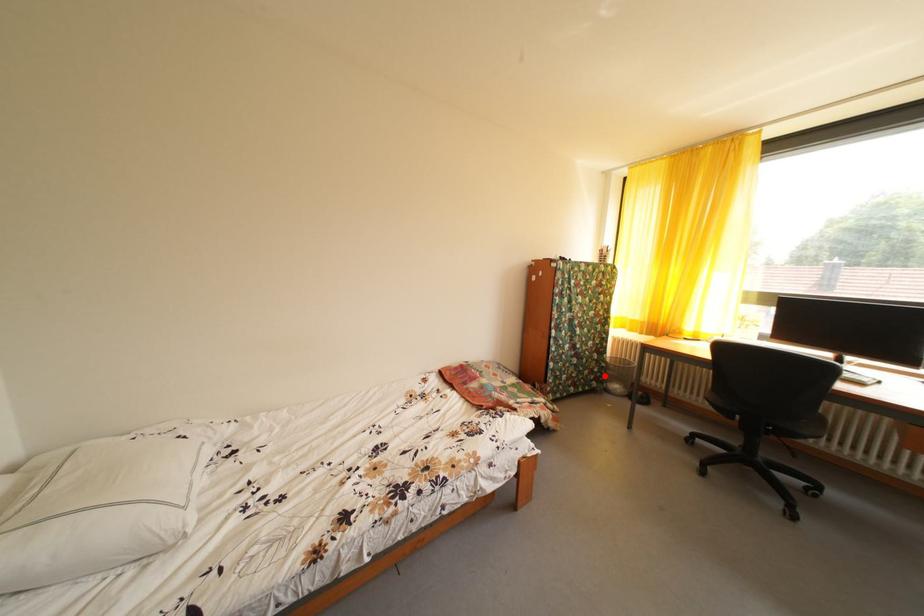
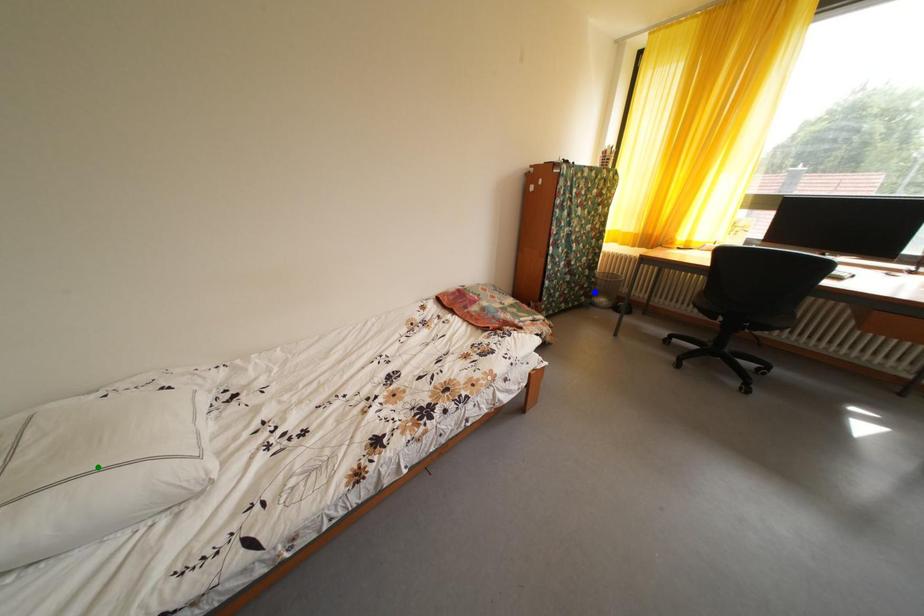
Question: I am providing you with two images of the same scene from different viewpoints. A red point is marked on the first image. You are given multiple points on the second image. Which mark in image 2 goes with the point in image 1?

Choices:
 (A) blue point
 (B) yellow point
 (C) green point

Answer: (A)